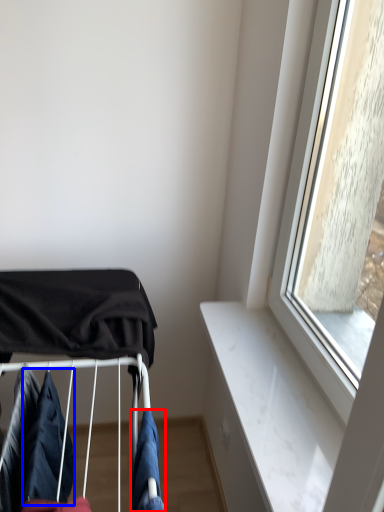
Question: Which object is closer to the camera taking this photo, clothing (highlighted by a red box) or clothing (highlighted by a blue box)?

Choices:
 (A) clothing
 (B) clothing

Answer: (A)